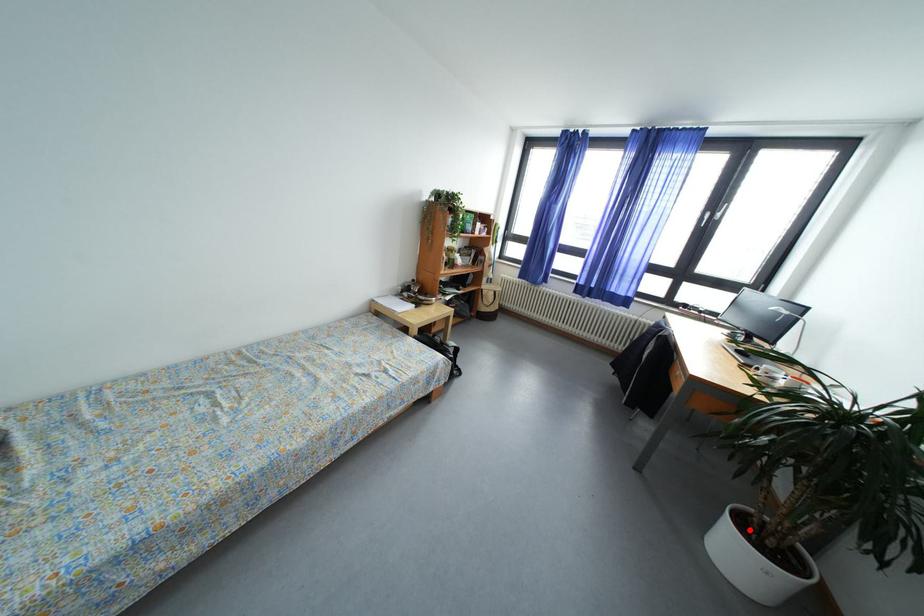
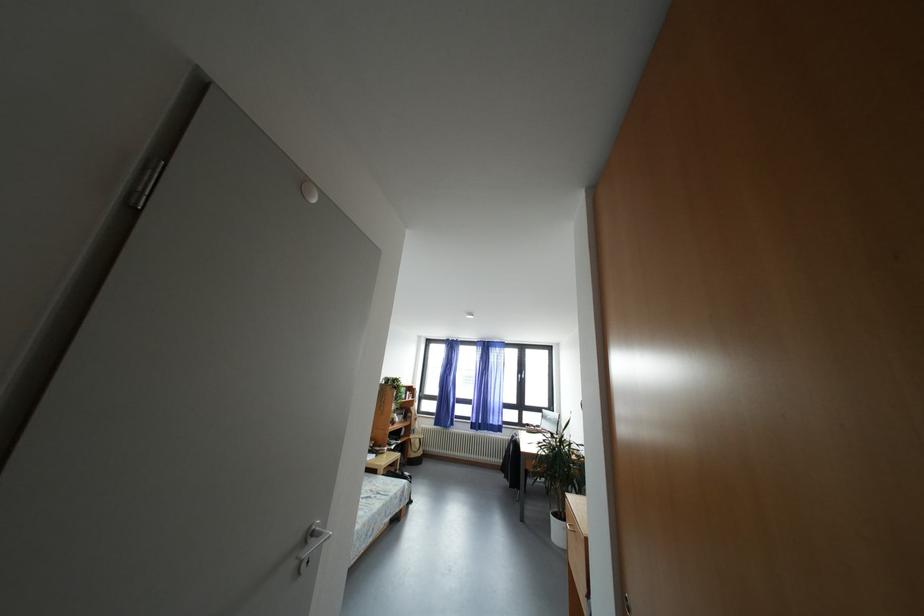
In the second image, find the point that corresponds to the highlighted location in the first image.

(562, 519)